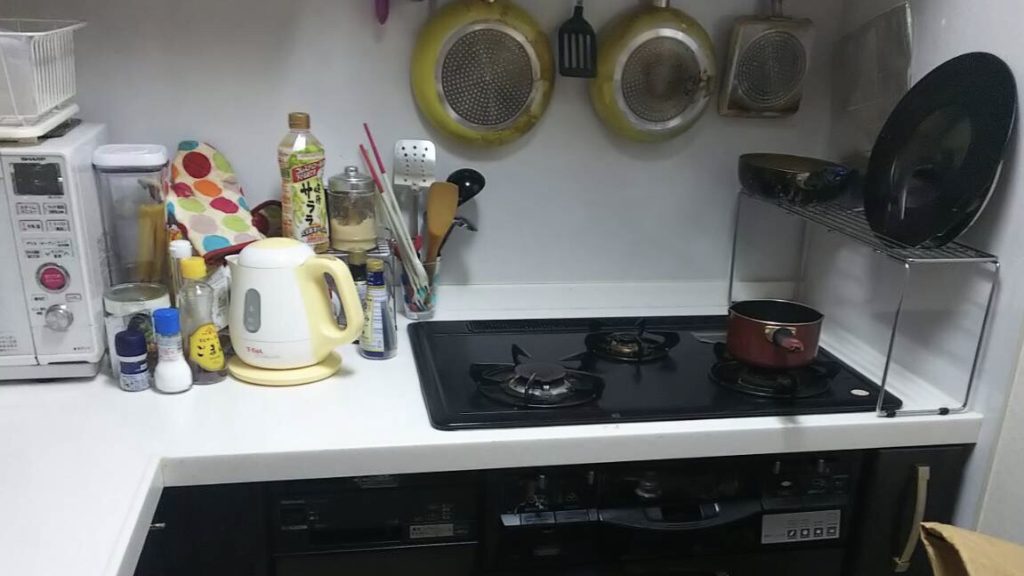
Where is `countertop`? The width and height of the screenshot is (1024, 576). countertop is located at coordinates (96, 466).